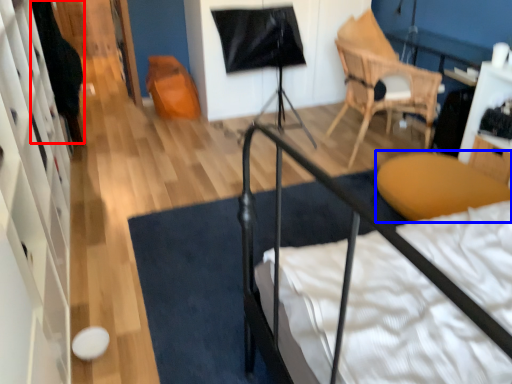
Question: Which point is further to the camera, dark (highlighted by a red box) or furniture (highlighted by a blue box)?

Choices:
 (A) dark
 (B) furniture

Answer: (A)